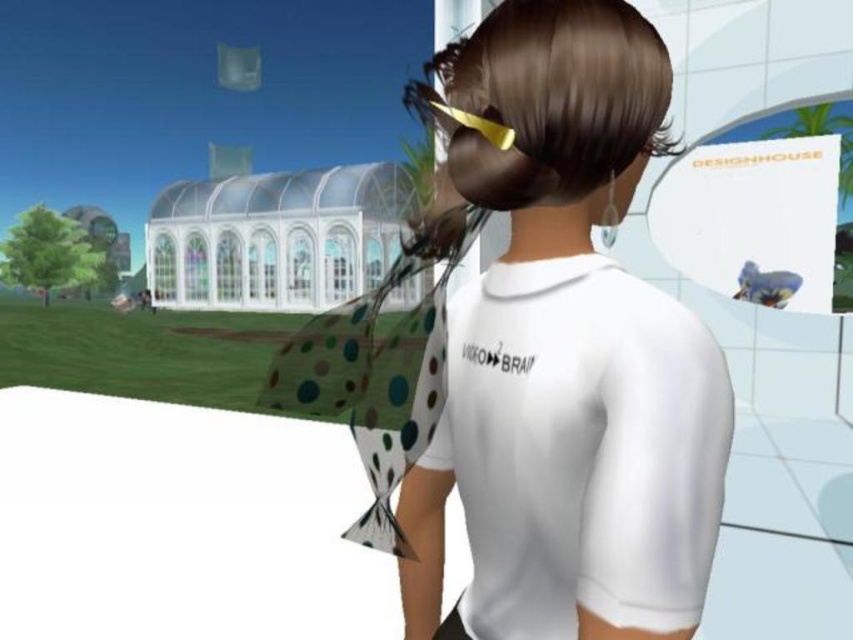
You are a character in the scene. You want to check the back of your white matte shirt at center. Which direction should you turn to see it?

You should turn to your left to see the back of your white matte shirt at center because the shirt is on your body, and turning left would allow you to look behind yourself.

You are a fashion designer observing the character in the image. You need to determine if the white matte shirt at center can be paired with a wider accessory than the shiny gold hair clip at upper center. Based on the scene, is this possible?

The white matte shirt at center has a width less than the shiny gold hair clip at upper center. Since the shirt is narrower than the hair clip, pairing them would mean the accessory is wider than the shirt, which is possible as the description allows for such a combination.

You are a fashion designer observing the scene. You need to determine the placement of the white matte shirt at center and the shiny gold hair clip at upper center. Which object is located higher in the image?

The shiny gold hair clip at upper center is higher since it is positioned above the white matte shirt at center.